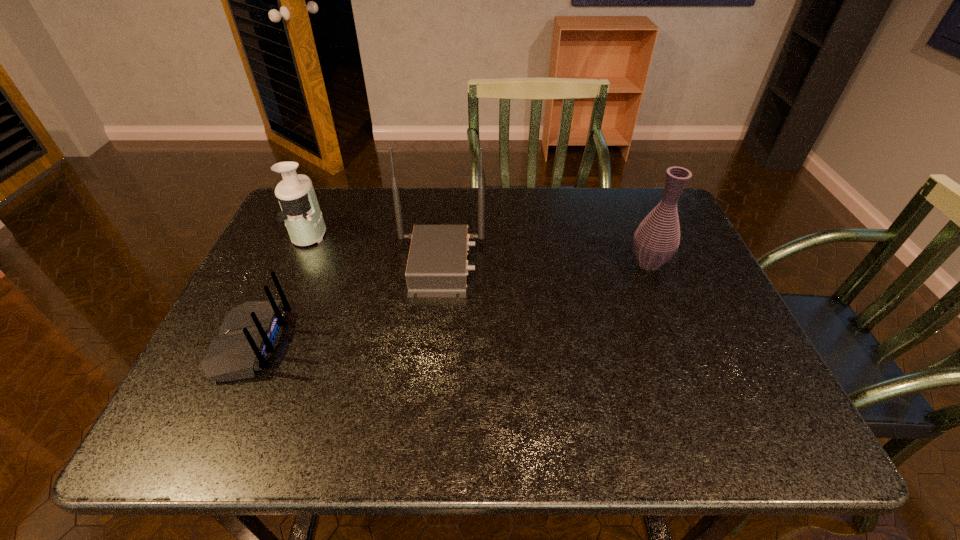
What are the coordinates of `object at the far edge` in the screenshot? It's located at (301, 213).

In order to click on juicer situated at the left edge in this screenshot , I will do `click(301, 213)`.

The width and height of the screenshot is (960, 540). I want to click on router at the left edge, so click(248, 336).

Identify the location of object situated at the right edge. The height and width of the screenshot is (540, 960). (656, 240).

Where is `object that is at the far left corner`? Image resolution: width=960 pixels, height=540 pixels. object that is at the far left corner is located at coordinates (301, 213).

Identify the location of vacant area at the far edge. (478, 190).

Identify the location of free space at the near edge of the desktop. (606, 444).

In the image, there is a desktop. Identify the location of vacant space at the left edge. Image resolution: width=960 pixels, height=540 pixels. (258, 376).

Locate an element on the screen. This screenshot has width=960, height=540. vacant region at the right edge of the desktop is located at coordinates (699, 266).

Locate an element on the screen. This screenshot has height=540, width=960. blank region between the rightmost object and the left router is located at coordinates (449, 303).